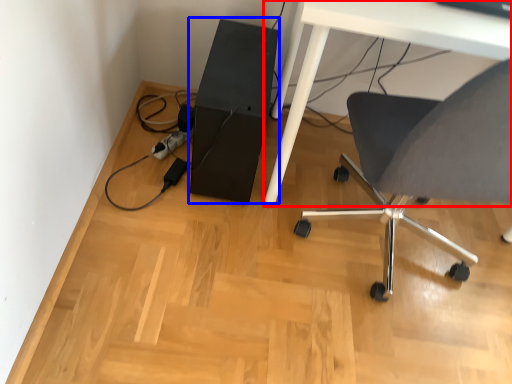
Question: Which point is closer to the camera, table (highlighted by a red box) or computer tower (highlighted by a blue box)?

Choices:
 (A) table
 (B) computer tower

Answer: (A)